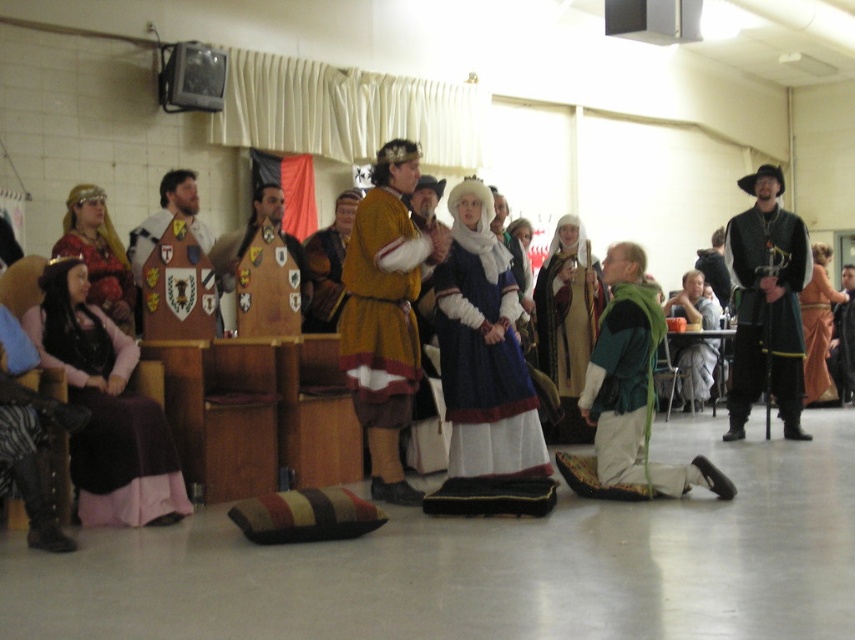
Question: Which of the following is the closest to the observer?

Choices:
 (A) blue velvet dress at center
 (B) matte gold armor at center

Answer: (B)

Question: Which point appears farthest from the camera in this image?

Choices:
 (A) (342, 330)
 (B) (379, 291)
 (C) (209, 241)

Answer: (C)

Question: Is blue velvet dress at center wider than wooden shield at center?

Choices:
 (A) no
 (B) yes

Answer: (B)

Question: Can you confirm if matte gold crown at center is bigger than blue velvet dress at center?

Choices:
 (A) no
 (B) yes

Answer: (B)

Question: Can you confirm if green velvet cape at center is positioned to the right of green velvet robe at lower center?

Choices:
 (A) no
 (B) yes

Answer: (A)

Question: Estimate the real-world distances between objects in this image. Which object is closer to the orange velvet dress at lower right?

Choices:
 (A) brown leather armor at center
 (B) wooden shield at center

Answer: (A)